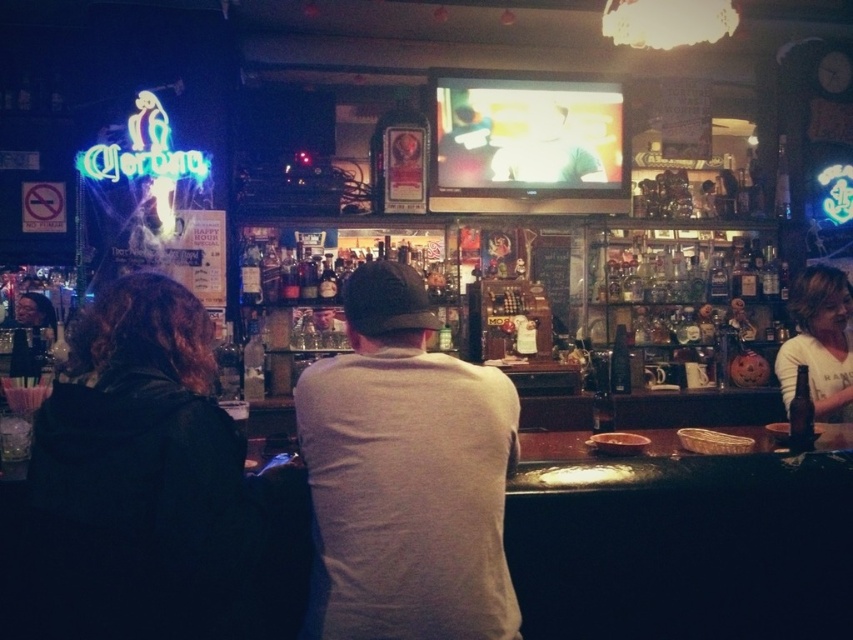
This screenshot has width=853, height=640. What do you see at coordinates (141, 481) in the screenshot?
I see `black leather jacket at left` at bounding box center [141, 481].

Looking at this image, is black leather jacket at left to the right of white cotton shirt at center from the viewer's perspective?

In fact, black leather jacket at left is to the left of white cotton shirt at center.

You are a GUI agent. You are given a task and a screenshot of the screen. Output one action in this format:
    pyautogui.click(x=<x>, y=<y>)
    Task: Click on the black leather jacket at left
    This screenshot has height=640, width=853.
    Given the screenshot: What is the action you would take?
    pyautogui.click(x=141, y=481)

Between black leather jacket at left and light brown hair at right, which one is positioned higher?

Positioned higher is light brown hair at right.

Is point (154, 300) in front of point (782, 404)?

Yes, point (154, 300) is closer to viewer.

Looking at this image, who is more distant from viewer, (195, 513) or (844, 321)?

Point (844, 321)

This screenshot has width=853, height=640. I want to click on black leather jacket at left, so click(x=141, y=481).

Is point (473, 621) more distant than point (848, 317)?

No, (473, 621) is closer to viewer.

Does dark gray hoodie at center appear over light brown hair at right?

Actually, dark gray hoodie at center is below light brown hair at right.

Does point (122, 435) come in front of point (851, 298)?

Yes, it is.

Identify the location of dark gray hoodie at center. Image resolution: width=853 pixels, height=640 pixels. (160, 492).